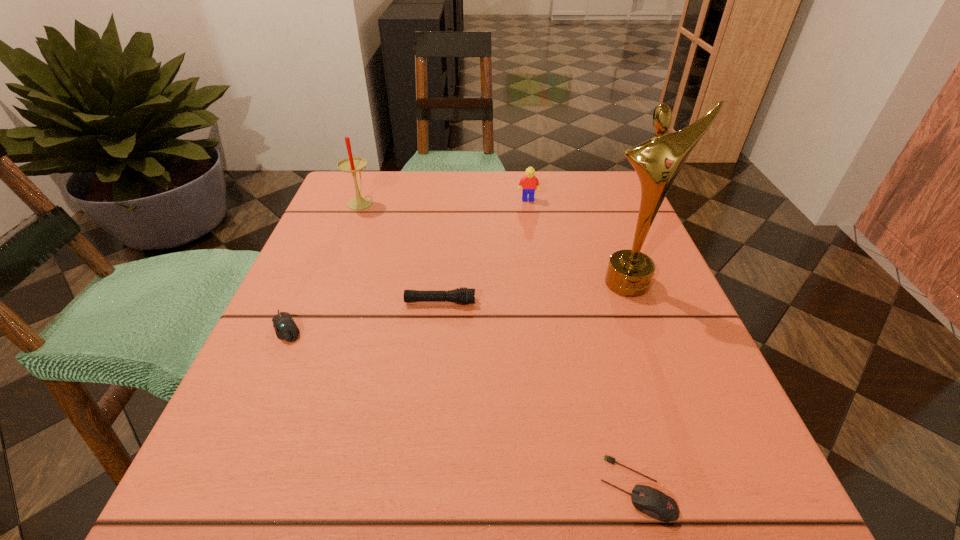
At what (x,y) coordinates should I click in order to perform the action: click on award. Please return your answer as a coordinate pair (x, y). The image size is (960, 540). Looking at the image, I should click on (657, 161).

I want to click on candle, so click(x=352, y=164).

Image resolution: width=960 pixels, height=540 pixels. Identify the location of the third object from right to left. (528, 184).

At what (x,y) coordinates should I click in order to perform the action: click on Lego. Please return your answer as a coordinate pair (x, y). The height and width of the screenshot is (540, 960). Looking at the image, I should click on (528, 184).

Find the location of `the third object from left to right`. the third object from left to right is located at coordinates [x=461, y=296].

What are the coordinates of `the third shortest object` in the screenshot? It's located at (461, 296).

The image size is (960, 540). In order to click on the farther mouse in this screenshot , I will do 285,327.

I want to click on the left mouse, so click(x=285, y=327).

The image size is (960, 540). I want to click on the right mouse, so click(x=650, y=501).

The width and height of the screenshot is (960, 540). I want to click on the nearest object, so click(650, 501).